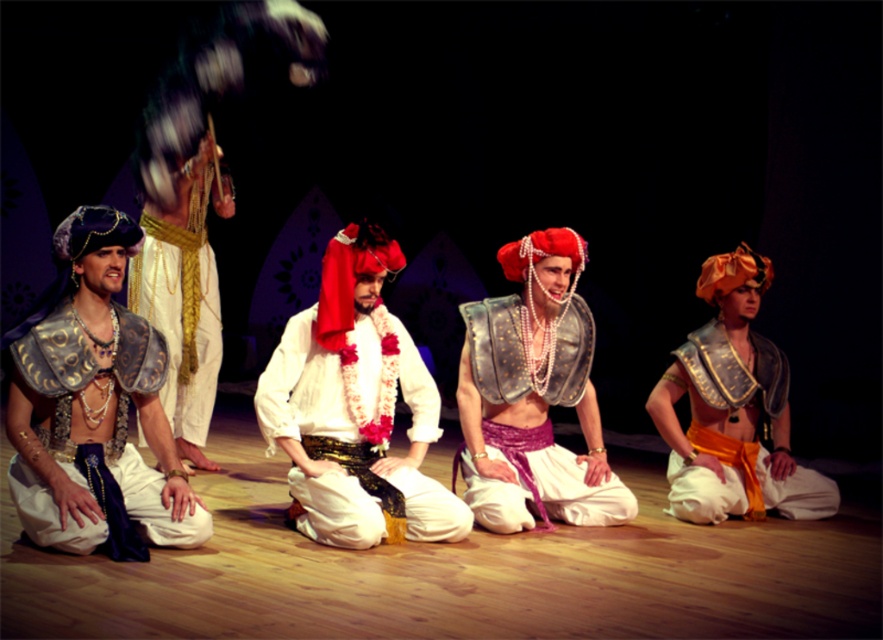
Question: Is matte gold armor at center to the right of metallic blue fabric at left from the viewer's perspective?

Choices:
 (A) no
 (B) yes

Answer: (B)

Question: Does white satin shirt at center have a greater width compared to matte gold armor at center?

Choices:
 (A) yes
 (B) no

Answer: (B)

Question: Can you confirm if white satin shirt at center is positioned to the right of metallic armor at center?

Choices:
 (A) no
 (B) yes

Answer: (A)

Question: Which object appears farthest from the camera in this image?

Choices:
 (A) metallic armor at center
 (B) metallic blue fabric at left
 (C) white satin shirt at center

Answer: (A)

Question: Which of these objects is positioned closest to the matte gold armor at center?

Choices:
 (A) white satin shirt at center
 (B) metallic armor at center
 (C) metallic blue fabric at left

Answer: (B)

Question: Among these points, which one is farthest from the camera?

Choices:
 (A) (89, 483)
 (B) (275, 388)
 (C) (768, 451)

Answer: (C)